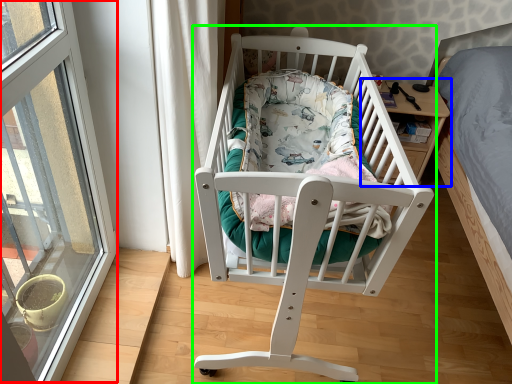
Question: Estimate the real-world distances between objects in this image. Which object is closer to window (highlighted by a red box), table (highlighted by a blue box) or infant bed (highlighted by a green box)?

Choices:
 (A) table
 (B) infant bed

Answer: (B)